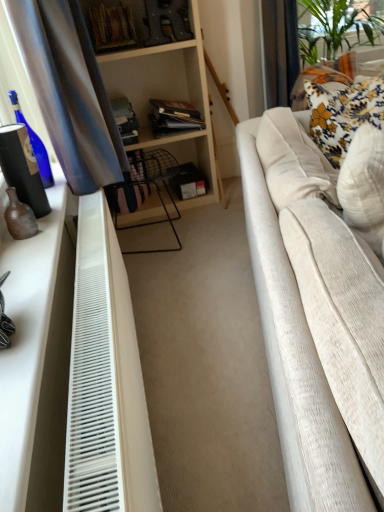
Question: Can you confirm if white textured pillow at right, the 1th pillow viewed from the front, is bigger than white plastic radiator at lower left?

Choices:
 (A) yes
 (B) no

Answer: (B)

Question: Considering the relative sizes of white textured pillow at right, the 1th pillow viewed from the front, and white plastic radiator at lower left in the image provided, is white textured pillow at right, the 1th pillow viewed from the front, taller than white plastic radiator at lower left?

Choices:
 (A) no
 (B) yes

Answer: (A)

Question: Is white textured pillow at right, acting as the second pillow starting from the back, thinner than white plastic radiator at lower left?

Choices:
 (A) no
 (B) yes

Answer: (A)

Question: Is the position of white textured pillow at right, acting as the second pillow starting from the back, more distant than that of white plastic radiator at lower left?

Choices:
 (A) no
 (B) yes

Answer: (B)

Question: Is white plastic radiator at lower left completely or partially inside white textured pillow at right, acting as the second pillow starting from the back?

Choices:
 (A) no
 (B) yes

Answer: (A)

Question: Considering the positions of floral fabric pillow at upper right, marked as the 2th pillow in a front-to-back arrangement, and white matte dresser at left in the image, is floral fabric pillow at upper right, marked as the 2th pillow in a front-to-back arrangement, wider or thinner than white matte dresser at left?

Choices:
 (A) wide
 (B) thin

Answer: (A)

Question: Is floral fabric pillow at upper right, marked as the 2th pillow in a front-to-back arrangement, inside the boundaries of white matte dresser at left, or outside?

Choices:
 (A) outside
 (B) inside

Answer: (A)

Question: Considering the relative positions of floral fabric pillow at upper right, marked as the 2th pillow in a front-to-back arrangement, and white matte dresser at left in the image provided, is floral fabric pillow at upper right, marked as the 2th pillow in a front-to-back arrangement, to the left or to the right of white matte dresser at left?

Choices:
 (A) right
 (B) left

Answer: (A)

Question: From a real-world perspective, relative to white matte dresser at left, is floral fabric pillow at upper right, marked as the 2th pillow in a front-to-back arrangement, vertically above or below?

Choices:
 (A) above
 (B) below

Answer: (A)

Question: Is floral fabric pillow at upper right, marked as the 2th pillow in a front-to-back arrangement, to the left or to the right of white plastic radiator at lower left in the image?

Choices:
 (A) right
 (B) left

Answer: (A)

Question: From the image's perspective, is floral fabric pillow at upper right, marked as the 2th pillow in a front-to-back arrangement, positioned above or below white plastic radiator at lower left?

Choices:
 (A) below
 (B) above

Answer: (B)

Question: Do you think floral fabric pillow at upper right, marked as the 2th pillow in a front-to-back arrangement, is within white plastic radiator at lower left, or outside of it?

Choices:
 (A) outside
 (B) inside

Answer: (A)

Question: Is point (349, 101) closer or farther from the camera than point (69, 470)?

Choices:
 (A) closer
 (B) farther

Answer: (B)

Question: Considering the positions of point click(x=365, y=169) and point click(x=18, y=466), is point click(x=365, y=169) closer or farther from the camera than point click(x=18, y=466)?

Choices:
 (A) farther
 (B) closer

Answer: (A)

Question: Considering their positions, is white textured pillow at right, the 1th pillow viewed from the front, located in front of or behind white matte dresser at left?

Choices:
 (A) front
 (B) behind

Answer: (B)